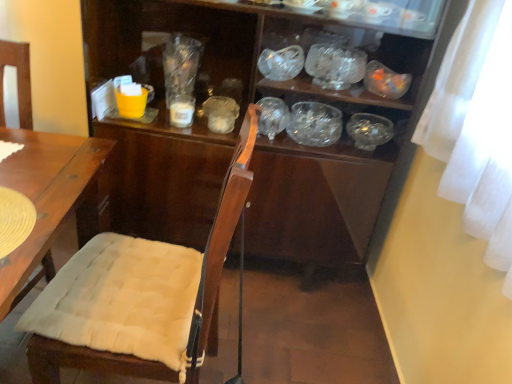
The width and height of the screenshot is (512, 384). Identify the location of blank space situated above transparent glass bowl at upper center, positioned as the 2th glass bowl in bottom-to-top order (from a real-world perspective). (342, 54).